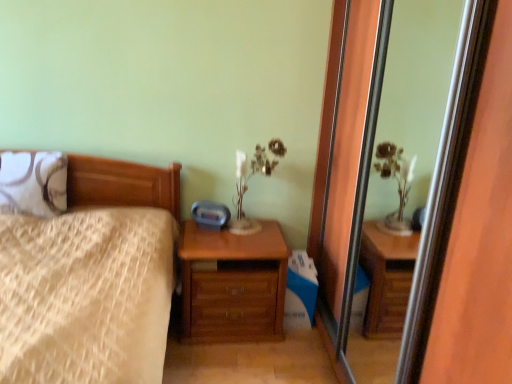
What is the approximate height of white textured pillow at left?

The height of white textured pillow at left is 12.84 inches.

What do you see at coordinates (33, 183) in the screenshot? I see `white textured pillow at left` at bounding box center [33, 183].

You are a GUI agent. You are given a task and a screenshot of the screen. Output one action in this format:
    pyautogui.click(x=<x>, y=<y>)
    Task: Click on the wooden chest of drawers at lower center
    The height and width of the screenshot is (384, 512).
    Given the screenshot: What is the action you would take?
    pyautogui.click(x=233, y=284)

Describe the element at coordinates (90, 280) in the screenshot. I see `wooden bed at left` at that location.

I want to click on white textured pillow at left, so coord(33,183).

Is point (341, 4) closer to camera compared to point (249, 223)?

Yes, it is.

From the image's perspective, is transparent glass screen door at center located above or below matte white glass table lamp at upper center?

transparent glass screen door at center is below matte white glass table lamp at upper center.

Considering the sizes of transparent glass screen door at center and matte white glass table lamp at upper center in the image, is transparent glass screen door at center wider or thinner than matte white glass table lamp at upper center?

Clearly, transparent glass screen door at center has less width compared to matte white glass table lamp at upper center.

Considering the sizes of objects transparent glass screen door at center and matte white glass table lamp at upper center in the image provided, who is shorter, transparent glass screen door at center or matte white glass table lamp at upper center?

With less height is matte white glass table lamp at upper center.

From a real-world perspective, is matte white glass table lamp at upper center above or below wooden chest of drawers at lower center?

matte white glass table lamp at upper center is above wooden chest of drawers at lower center.

Does point (243, 167) lie behind point (195, 259)?

Yes.

Can you confirm if matte white glass table lamp at upper center is positioned to the right of wooden chest of drawers at lower center?

Yes.

Is matte white glass table lamp at upper center smaller than wooden chest of drawers at lower center?

Correct, matte white glass table lamp at upper center occupies less space than wooden chest of drawers at lower center.

What's the angular difference between transparent glass screen door at center and wooden chest of drawers at lower center's facing directions?

transparent glass screen door at center and wooden chest of drawers at lower center are facing 89.7 degrees away from each other.

Is transparent glass screen door at center inside or outside of wooden chest of drawers at lower center?

transparent glass screen door at center is not inside wooden chest of drawers at lower center, it's outside.

In the image, is transparent glass screen door at center on the left side or the right side of wooden chest of drawers at lower center?

From the image, it's evident that transparent glass screen door at center is to the right of wooden chest of drawers at lower center.

Considering the sizes of objects transparent glass screen door at center and wooden chest of drawers at lower center in the image provided, who is wider, transparent glass screen door at center or wooden chest of drawers at lower center?

wooden chest of drawers at lower center is wider.

Can transparent glass screen door at center be found inside wooden bed at left?

No.

How many degrees apart are the facing directions of wooden bed at left and transparent glass screen door at center?

The angle between the facing direction of wooden bed at left and the facing direction of transparent glass screen door at center is 89.3 degrees.

Does point (123, 205) lie behind point (384, 43)?

Yes, it is behind point (384, 43).

Which object is thinner, wooden bed at left or transparent glass screen door at center?

transparent glass screen door at center.

Is wooden chest of drawers at lower center facing towards white textured pillow at left?

No, wooden chest of drawers at lower center is not turned towards white textured pillow at left.

How many degrees apart are the facing directions of wooden chest of drawers at lower center and white textured pillow at left?

The facing directions of wooden chest of drawers at lower center and white textured pillow at left are 0.392 degrees apart.

Based on their positions, is wooden chest of drawers at lower center located to the left or right of white textured pillow at left?

wooden chest of drawers at lower center is to the right of white textured pillow at left.

This screenshot has width=512, height=384. What are the coordinates of `chest of drawers below the white textured pillow at left (from a real-world perspective)` in the screenshot? It's located at (233, 284).

Is wooden chest of drawers at lower center in contact with wooden bed at left?

There is a gap between wooden chest of drawers at lower center and wooden bed at left.

Is wooden chest of drawers at lower center to the left of wooden bed at left from the viewer's perspective?

No, wooden chest of drawers at lower center is not to the left of wooden bed at left.

Is wooden chest of drawers at lower center facing away from wooden bed at left?

wooden chest of drawers at lower center is not turned away from wooden bed at left.

In the image, is wooden chest of drawers at lower center positioned in front of or behind wooden bed at left?

wooden chest of drawers at lower center is positioned farther from the viewer than wooden bed at left.

Is transparent glass screen door at center with wooden bed at left?

No, transparent glass screen door at center is not in contact with wooden bed at left.

Is transparent glass screen door at center situated inside wooden bed at left or outside?

transparent glass screen door at center is located beyond the bounds of wooden bed at left.

Can you confirm if transparent glass screen door at center is bigger than wooden bed at left?

No, transparent glass screen door at center is not bigger than wooden bed at left.

Find the location of `screen door on the right of matte white glass table lamp at upper center`. screen door on the right of matte white glass table lamp at upper center is located at coordinates (350, 151).

Locate an element on the screen. This screenshot has width=512, height=384. table lamp behind the wooden chest of drawers at lower center is located at coordinates pyautogui.click(x=247, y=187).

From the image, which object appears to be farther from wooden bed at left, wooden chest of drawers at lower center or white textured pillow at left?

wooden chest of drawers at lower center is further to wooden bed at left.

Which object lies nearer to the anchor point transparent glass screen door at center, matte white glass table lamp at upper center or wooden chest of drawers at lower center?

matte white glass table lamp at upper center is positioned closer to the anchor transparent glass screen door at center.

Estimate the real-world distances between objects in this image. Which object is closer to wooden chest of drawers at lower center, wooden bed at left or transparent glass screen door at center?

wooden bed at left is positioned closer to the anchor wooden chest of drawers at lower center.

When comparing their distances from wooden bed at left, does white textured pillow at left or transparent glass screen door at center seem further?

transparent glass screen door at center lies further to wooden bed at left than the other object.

Looking at this image, estimate the real-world distances between objects in this image. Which object is further from transparent glass screen door at center, matte white glass table lamp at upper center or wooden bed at left?

wooden bed at left.

Which object lies nearer to the anchor point matte white glass table lamp at upper center, white textured pillow at left or wooden bed at left?

Based on the image, wooden bed at left appears to be nearer to matte white glass table lamp at upper center.

Which object lies nearer to the anchor point matte white glass table lamp at upper center, white textured pillow at left or transparent glass screen door at center?

transparent glass screen door at center.

In the scene shown: Based on their spatial positions, is wooden bed at left or white textured pillow at left further from wooden chest of drawers at lower center?

white textured pillow at left is positioned further to the anchor wooden chest of drawers at lower center.

Locate an element on the screen. The height and width of the screenshot is (384, 512). chest of drawers between white textured pillow at left and matte white glass table lamp at upper center from left to right is located at coordinates (233, 284).

Where is `the chest of drawers positioned between transparent glass screen door at center and matte white glass table lamp at upper center from near to far`? The height and width of the screenshot is (384, 512). the chest of drawers positioned between transparent glass screen door at center and matte white glass table lamp at upper center from near to far is located at coordinates (233, 284).

Locate an element on the screen. The width and height of the screenshot is (512, 384). bed positioned between transparent glass screen door at center and wooden chest of drawers at lower center from near to far is located at coordinates (90, 280).

In order to click on pillow positioned between wooden bed at left and matte white glass table lamp at upper center from near to far in this screenshot , I will do `click(33, 183)`.